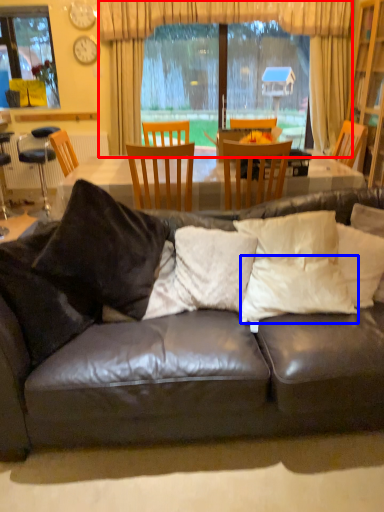
Question: Which object is further to the camera taking this photo, curtain (highlighted by a red box) or pillow (highlighted by a blue box)?

Choices:
 (A) curtain
 (B) pillow

Answer: (A)